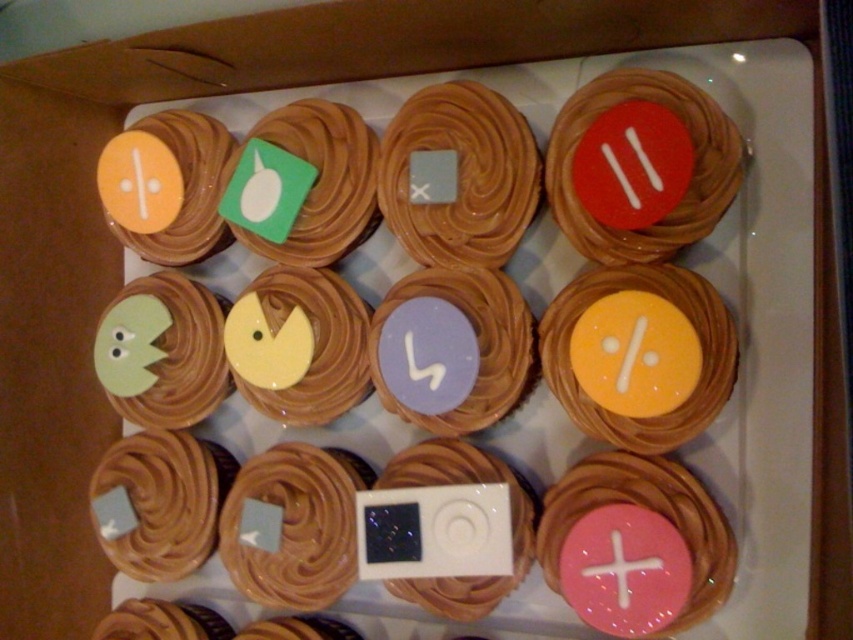
You are organizing a music themed birthday party and have these two items on a table. The matte brown cupcake at center and the white glossy ipod at center. Which one is more to the left?

The matte brown cupcake at center is more to the left because it is positioned on the left side of the white glossy ipod at center.

You are a food delivery person who needs to place a matte brown cupcake at center and a white glossy ipod at center into a box that is 12 inches wide. Can both items fit side by side without overlapping?

The matte brown cupcake at center and white glossy ipod at center are 13.30 inches apart from each other. Since the box is only 12 inches wide, they cannot fit side by side without overlapping.

Based on the photo, you are designing a music player interface and want to ensure that the red matte button at upper right is easily distinguishable from the white glossy ipod at center. Considering their sizes, which button should you make larger to achieve this?

The red matte button at upper right is smaller than the white glossy ipod at center. To make them easily distinguishable, you should make the red matte button at upper right larger so it stands out more.